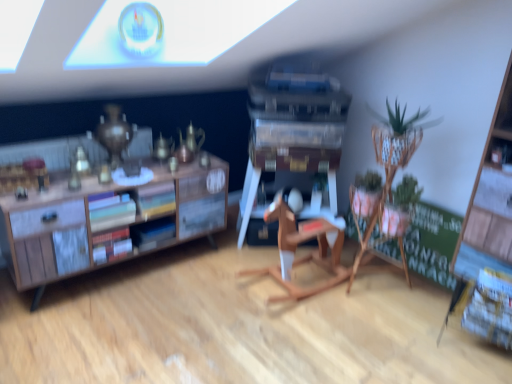
Image resolution: width=512 pixels, height=384 pixels. Describe the element at coordinates (152, 233) in the screenshot. I see `blue matte book at center, the 1th book when ordered from bottom to top` at that location.

Measure the distance between green chalkboard at right and camera.

7.89 feet.

What do you see at coordinates (111, 210) in the screenshot?
I see `matte hardcover books at center left, which appears as the second book when ordered from the bottom` at bounding box center [111, 210].

This screenshot has width=512, height=384. Describe the element at coordinates (388, 184) in the screenshot. I see `green woven basket at upper right` at that location.

This screenshot has width=512, height=384. I want to click on blue matte book at center, positioned as the 2th book in top-to-bottom order, so click(x=152, y=233).

Looking at their sizes, would you say blue matte book at center, the 1th book when ordered from bottom to top, is wider or thinner than wooden rocking horse at center?

Considering their sizes, blue matte book at center, the 1th book when ordered from bottom to top, looks slimmer than wooden rocking horse at center.

Is blue matte book at center, positioned as the 2th book in top-to-bottom order, spatially inside wooden rocking horse at center, or outside of it?

blue matte book at center, positioned as the 2th book in top-to-bottom order, is spatially situated outside wooden rocking horse at center.

How many degrees apart are the facing directions of blue matte book at center, the 1th book when ordered from bottom to top, and wooden rocking horse at center?

There is a 95-degree angle between the facing directions of blue matte book at center, the 1th book when ordered from bottom to top, and wooden rocking horse at center.

Considering the relative sizes of green woven basket at upper right and matte hardcover books at center left, which appears as the second book when ordered from the bottom, in the image provided, is green woven basket at upper right bigger than matte hardcover books at center left, which appears as the second book when ordered from the bottom,?

Indeed, green woven basket at upper right has a larger size compared to matte hardcover books at center left, which appears as the second book when ordered from the bottom.

From a real-world perspective, is green woven basket at upper right positioned over matte hardcover books at center left, which appears as the second book when ordered from the bottom, based on gravity?

No, from a real-world perspective, green woven basket at upper right is not on top of matte hardcover books at center left, which appears as the second book when ordered from the bottom.

From the image's perspective, would you say green woven basket at upper right is shown under matte hardcover books at center left, which appears as the second book when ordered from the bottom?

Yes.

Is green woven basket at upper right not inside matte hardcover books at center left, which appears as the second book when ordered from the bottom?

Yes.

Is green chalkboard at right shorter than blue matte book at center, positioned as the 2th book in top-to-bottom order?

No, green chalkboard at right is not shorter than blue matte book at center, positioned as the 2th book in top-to-bottom order.

Is green chalkboard at right completely or partially outside of blue matte book at center, the 1th book when ordered from bottom to top?

green chalkboard at right is positioned outside blue matte book at center, the 1th book when ordered from bottom to top.

Find the location of a particular element. The image size is (512, 384). bulletin board behind the blue matte book at center, positioned as the 2th book in top-to-bottom order is located at coordinates (432, 243).

Is matte hardcover books at center left, which appears as the second book when ordered from the bottom, wider than green chalkboard at right?

Indeed, matte hardcover books at center left, which appears as the second book when ordered from the bottom, has a greater width compared to green chalkboard at right.

From the image's perspective, is matte hardcover books at center left, which appears as the second book when ordered from the bottom, located above or below green chalkboard at right?

From the image's perspective, matte hardcover books at center left, which appears as the second book when ordered from the bottom, appears above green chalkboard at right.

Is matte hardcover books at center left, placed as the 1th book when sorted from top to bottom, taller than green chalkboard at right?

In fact, matte hardcover books at center left, placed as the 1th book when sorted from top to bottom, may be shorter than green chalkboard at right.

Is matte hardcover books at center left, which appears as the second book when ordered from the bottom, placed right next to green chalkboard at right?

No, matte hardcover books at center left, which appears as the second book when ordered from the bottom, is not beside green chalkboard at right.

Are green woven basket at upper right and green chalkboard at right located far from each other?

No, green woven basket at upper right is not far from green chalkboard at right.

Who is smaller, green woven basket at upper right or green chalkboard at right?

green chalkboard at right.

Which of these two, green woven basket at upper right or green chalkboard at right, stands taller?

green woven basket at upper right is taller.

Is green woven basket at upper right thinner than green chalkboard at right?

Incorrect, the width of green woven basket at upper right is not less than that of green chalkboard at right.

Identify the location of book behind the matte hardcover books at center left, placed as the 1th book when sorted from top to bottom. (152, 233).

Does blue matte book at center, the 1th book when ordered from bottom to top, have a greater height compared to matte hardcover books at center left, placed as the 1th book when sorted from top to bottom?

No.

From the picture: Which object is more forward, blue matte book at center, positioned as the 2th book in top-to-bottom order, or matte hardcover books at center left, placed as the 1th book when sorted from top to bottom?

matte hardcover books at center left, placed as the 1th book when sorted from top to bottom, is more forward.

Which point is more distant from viewer, (166, 227) or (118, 214)?

The point (166, 227) is more distant.

Does wooden rocking horse at center lie behind matte hardcover books at center left, placed as the 1th book when sorted from top to bottom?

No, wooden rocking horse at center is closer to the camera.

Consider the image. Which point is more forward, (330, 261) or (120, 201)?

Positioned in front is point (120, 201).

Looking at their sizes, would you say wooden rocking horse at center is wider or thinner than matte hardcover books at center left, which appears as the second book when ordered from the bottom?

In the image, wooden rocking horse at center appears to be wider than matte hardcover books at center left, which appears as the second book when ordered from the bottom.

From the image's perspective, which is above, wooden rocking horse at center or matte hardcover books at center left, placed as the 1th book when sorted from top to bottom?

matte hardcover books at center left, placed as the 1th book when sorted from top to bottom.

Image resolution: width=512 pixels, height=384 pixels. I want to click on chair in front of the blue matte book at center, positioned as the 2th book in top-to-bottom order, so click(307, 257).

Locate an element on the screen. The height and width of the screenshot is (384, 512). book above the green woven basket at upper right (from the image's perspective) is located at coordinates (111, 210).

Considering their positions, is matte hardcover books at center left, placed as the 1th book when sorted from top to bottom, positioned closer to green woven basket at upper right than wooden rocking horse at center?

Among the two, wooden rocking horse at center is located nearer to green woven basket at upper right.

Looking at the image, which one is located further to matte hardcover books at center left, placed as the 1th book when sorted from top to bottom, green woven basket at upper right or wooden rocking horse at center?

green woven basket at upper right is further to matte hardcover books at center left, placed as the 1th book when sorted from top to bottom.

Looking at the image, which one is located further to matte hardcover books at center left, which appears as the second book when ordered from the bottom, blue matte book at center, positioned as the 2th book in top-to-bottom order, or green chalkboard at right?

The object further to matte hardcover books at center left, which appears as the second book when ordered from the bottom, is green chalkboard at right.

From the image, which object appears to be farther from green chalkboard at right, green woven basket at upper right or matte hardcover books at center left, which appears as the second book when ordered from the bottom?

matte hardcover books at center left, which appears as the second book when ordered from the bottom, is positioned further to the anchor green chalkboard at right.

Based on their spatial positions, is matte hardcover books at center left, which appears as the second book when ordered from the bottom, or blue matte book at center, the 1th book when ordered from bottom to top, closer to wooden rocking horse at center?

blue matte book at center, the 1th book when ordered from bottom to top, lies closer to wooden rocking horse at center than the other object.

From the picture: Estimate the real-world distances between objects in this image. Which object is further from matte hardcover books at center left, placed as the 1th book when sorted from top to bottom, wooden rocking horse at center or green woven basket at upper right?

Based on the image, green woven basket at upper right appears to be further to matte hardcover books at center left, placed as the 1th book when sorted from top to bottom.

Which object lies nearer to the anchor point green woven basket at upper right, blue matte book at center, the 1th book when ordered from bottom to top, or wooden rocking horse at center?

Among the two, wooden rocking horse at center is located nearer to green woven basket at upper right.

Which object lies nearer to the anchor point wooden rocking horse at center, green woven basket at upper right or matte hardcover books at center left, which appears as the second book when ordered from the bottom?

Among the two, green woven basket at upper right is located nearer to wooden rocking horse at center.

This screenshot has height=384, width=512. Identify the location of book between matte hardcover books at center left, which appears as the second book when ordered from the bottom, and wooden rocking horse at center, in the horizontal direction. (152, 233).

Find the location of a particular element. This screenshot has height=384, width=512. houseplant between matte hardcover books at center left, placed as the 1th book when sorted from top to bottom, and green chalkboard at right, in the horizontal direction is located at coordinates (388, 184).

What are the coordinates of `houseplant between blue matte book at center, positioned as the 2th book in top-to-bottom order, and green chalkboard at right from left to right` in the screenshot? It's located at (388, 184).

Locate an element on the screen. The width and height of the screenshot is (512, 384). chair between blue matte book at center, positioned as the 2th book in top-to-bottom order, and green woven basket at upper right, in the horizontal direction is located at coordinates (307, 257).